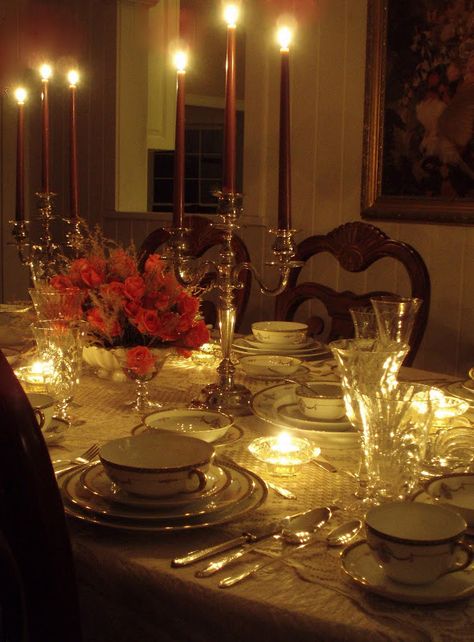
Locate an element on the screen. This screenshot has width=474, height=642. candles is located at coordinates (23, 128), (51, 132), (78, 146), (186, 146), (234, 146), (284, 153), (34, 363), (275, 443), (200, 349), (430, 395).